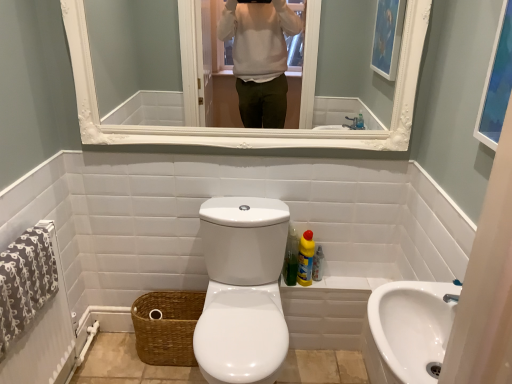
Question: Could you tell me if yellow liquid cleaner at lower right is facing white glossy mirror at upper center?

Choices:
 (A) yes
 (B) no

Answer: (B)

Question: Would you say yellow liquid cleaner at lower right is outside white glossy mirror at upper center?

Choices:
 (A) no
 (B) yes

Answer: (B)

Question: Is yellow liquid cleaner at lower right further to the viewer compared to white glossy mirror at upper center?

Choices:
 (A) yes
 (B) no

Answer: (A)

Question: Is yellow liquid cleaner at lower right facing away from white glossy mirror at upper center?

Choices:
 (A) no
 (B) yes

Answer: (A)

Question: Is white glossy mirror at upper center a part of yellow liquid cleaner at lower right?

Choices:
 (A) yes
 (B) no

Answer: (B)

Question: From a real-world perspective, is white glossy toilet at center physically located above or below brown woven basket at lower left?

Choices:
 (A) below
 (B) above

Answer: (B)

Question: In the image, is white glossy toilet at center on the left side or the right side of brown woven basket at lower left?

Choices:
 (A) left
 (B) right

Answer: (B)

Question: Is white glossy toilet at center inside or outside of brown woven basket at lower left?

Choices:
 (A) inside
 (B) outside

Answer: (B)

Question: In terms of height, does white glossy toilet at center look taller or shorter compared to brown woven basket at lower left?

Choices:
 (A) short
 (B) tall

Answer: (B)

Question: Is blue glass picture frame at upper right inside the boundaries of yellow liquid cleaner at lower right, or outside?

Choices:
 (A) inside
 (B) outside

Answer: (B)

Question: From the image's perspective, is blue glass picture frame at upper right above or below yellow liquid cleaner at lower right?

Choices:
 (A) above
 (B) below

Answer: (A)

Question: Considering their positions, is blue glass picture frame at upper right located in front of or behind yellow liquid cleaner at lower right?

Choices:
 (A) behind
 (B) front

Answer: (B)

Question: Visually, is blue glass picture frame at upper right positioned to the left or to the right of yellow liquid cleaner at lower right?

Choices:
 (A) right
 (B) left

Answer: (A)

Question: Is white glossy sink at lower right taller or shorter than white glossy toilet at center?

Choices:
 (A) short
 (B) tall

Answer: (A)

Question: From a real-world perspective, is white glossy sink at lower right physically located above or below white glossy toilet at center?

Choices:
 (A) above
 (B) below

Answer: (A)